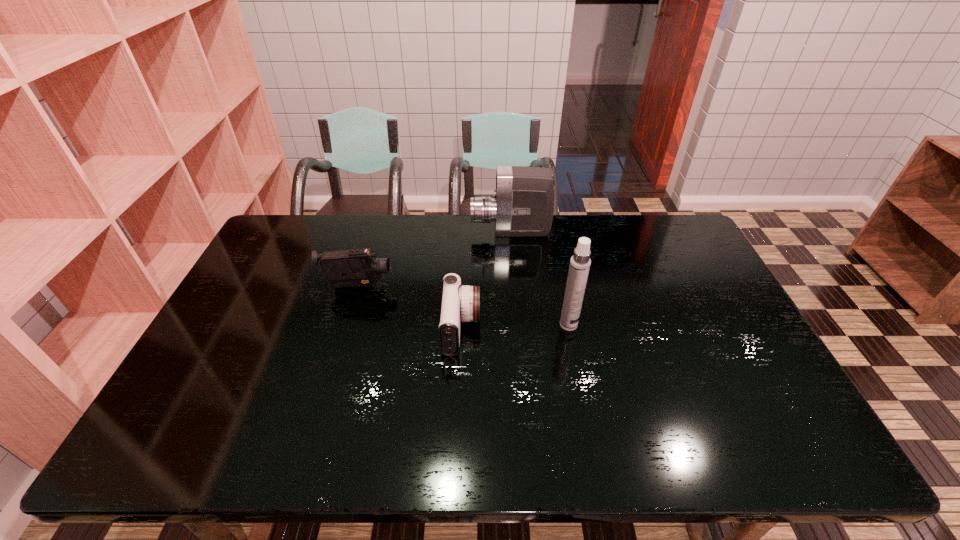
At what (x,y) coordinates should I click in order to perform the action: click on blank space located 0.110m on the front-facing side of the second farthest camcorder. Please return your answer as a coordinate pair (x, y). The height and width of the screenshot is (540, 960). Looking at the image, I should click on (428, 286).

You are a GUI agent. You are given a task and a screenshot of the screen. Output one action in this format:
    pyautogui.click(x=<x>, y=<y>)
    Task: Click on the free space located on the surface of the nearest camcorder
    The width and height of the screenshot is (960, 540).
    Given the screenshot: What is the action you would take?
    pyautogui.click(x=557, y=328)

Locate an element on the screen. object present at the far edge is located at coordinates (523, 205).

This screenshot has width=960, height=540. What are the coordinates of `free spot at the far edge of the desktop` in the screenshot? It's located at (551, 233).

Find the location of a particular element. The height and width of the screenshot is (540, 960). vacant space at the near edge of the desktop is located at coordinates [732, 442].

Locate an element on the screen. blank space at the left edge of the desktop is located at coordinates (266, 289).

You are a GUI agent. You are given a task and a screenshot of the screen. Output one action in this format:
    pyautogui.click(x=<x>, y=<y>)
    Task: Click on the vacant space at the right edge of the desktop
    
    Given the screenshot: What is the action you would take?
    pyautogui.click(x=721, y=348)

At what (x,y) coordinates should I click in order to perform the action: click on free space at the far left corner of the desktop. Please return your answer as a coordinate pair (x, y). The width and height of the screenshot is (960, 540). Looking at the image, I should click on (303, 232).

Locate an element on the screen. blank region between the nearest camcorder and the tallest object is located at coordinates (515, 327).

The height and width of the screenshot is (540, 960). I want to click on free spot between the nearest camcorder and the tallest camcorder, so click(486, 280).